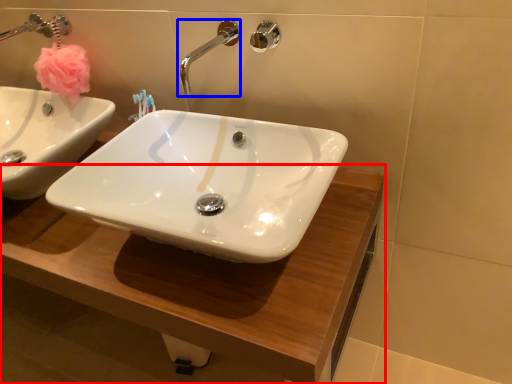
Question: Which object is closer to the camera taking this photo, counter top (highlighted by a red box) or tap (highlighted by a blue box)?

Choices:
 (A) counter top
 (B) tap

Answer: (A)